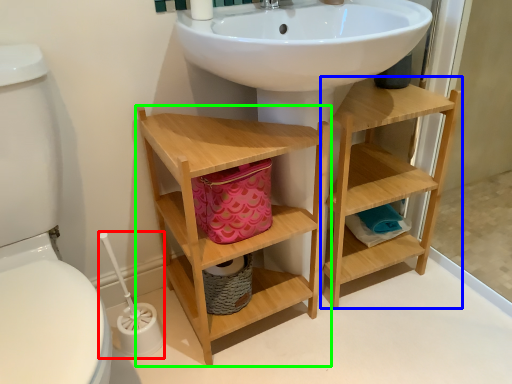
Question: Based on their relative distances, which object is nearer to brush (highlighted by a red box)? Choose from shelf (highlighted by a blue box) and bathroom cabinet (highlighted by a green box).

Choices:
 (A) shelf
 (B) bathroom cabinet

Answer: (B)